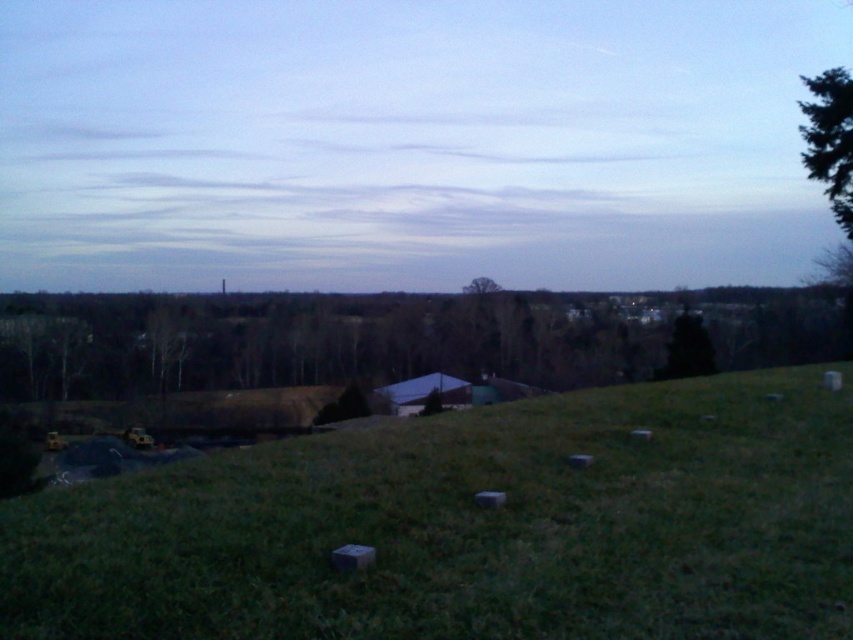
Does blue sky at upper center lie in front of green grassy hill at lower center?

No, blue sky at upper center is behind green grassy hill at lower center.

Who is taller, blue sky at upper center or green grassy hill at lower center?

blue sky at upper center

Does point (195, 186) lie in front of point (392, 596)?

No.

Where is `blue sky at upper center`? This screenshot has width=853, height=640. blue sky at upper center is located at coordinates (409, 141).

Consider the image. Does blue sky at upper center appear under green leafy tree at center?

Actually, blue sky at upper center is above green leafy tree at center.

What do you see at coordinates (409, 141) in the screenshot?
I see `blue sky at upper center` at bounding box center [409, 141].

The image size is (853, 640). I want to click on blue sky at upper center, so click(x=409, y=141).

Based on the photo, does blue sky at upper center appear over green textured tree at upper right?

Correct, blue sky at upper center is located above green textured tree at upper right.

Is blue sky at upper center positioned in front of green textured tree at upper right?

No, blue sky at upper center is further to the viewer.

Which is in front, point (152, 253) or point (842, 124)?

Positioned in front is point (842, 124).

Image resolution: width=853 pixels, height=640 pixels. What are the coordinates of `blue sky at upper center` in the screenshot? It's located at (409, 141).